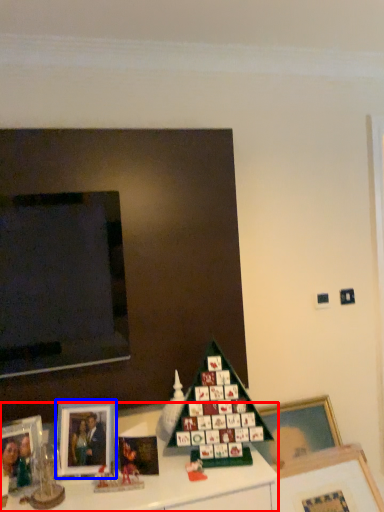
Question: Among these objects, which one is nearest to the camera, furniture (highlighted by a red box) or picture frame (highlighted by a blue box)?

Choices:
 (A) furniture
 (B) picture frame

Answer: (A)